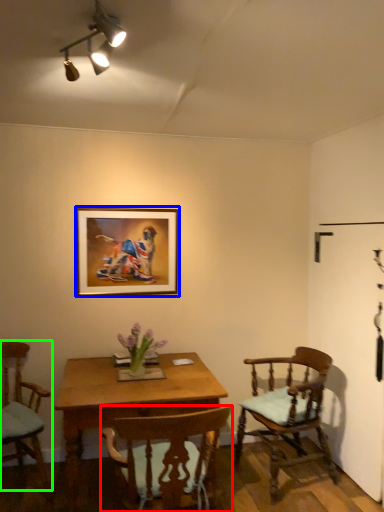
Question: Which object is positioned farthest from chair (highlighted by a red box)? Select from picture frame (highlighted by a blue box) and chair (highlighted by a green box).

Choices:
 (A) picture frame
 (B) chair

Answer: (A)